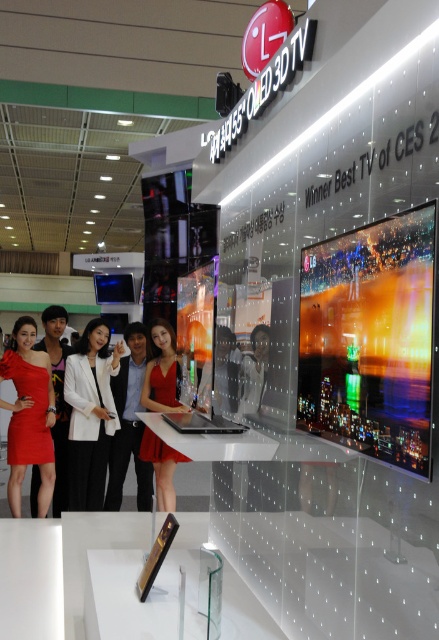
You are a fashion designer attending the expo and see the white matte blazer at center and the red satin dress at center on the display stand. Which garment is taller?

The white matte blazer at center is taller than the red satin dress at center.

From the picture: You are a fashion designer observing the LG OLED 3D TV display. You notice a white matte blazer at center and a matte red dress at lower left. Which garment has a greater width when viewed from your current position?

The white matte blazer at center has a greater width than the matte red dress at lower left.

You are an event organizer at the expo and need to place a new promotional banner. The banner requires a space that is 0.3 meters away from the LG OLED 3D TV. Given the current setup, is there enough space at the point marked at coordinates (89, 413) to place the banner without it being too close to the TV?

The point at coordinates (89, 413) has a white matte blazer at center. Since the banner needs to be placed 0.3 meters away from the TV, but the blazer is already occupying that location, there isn not enough space to place the banner there without it being too close to the TV.